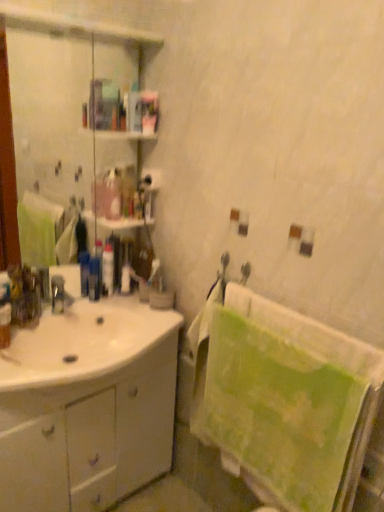
The width and height of the screenshot is (384, 512). Identify the location of vacant area that is situated to the right of blue plastic toothbrush at center, which ranks as the 3th toiletry in right-to-left order. (114, 303).